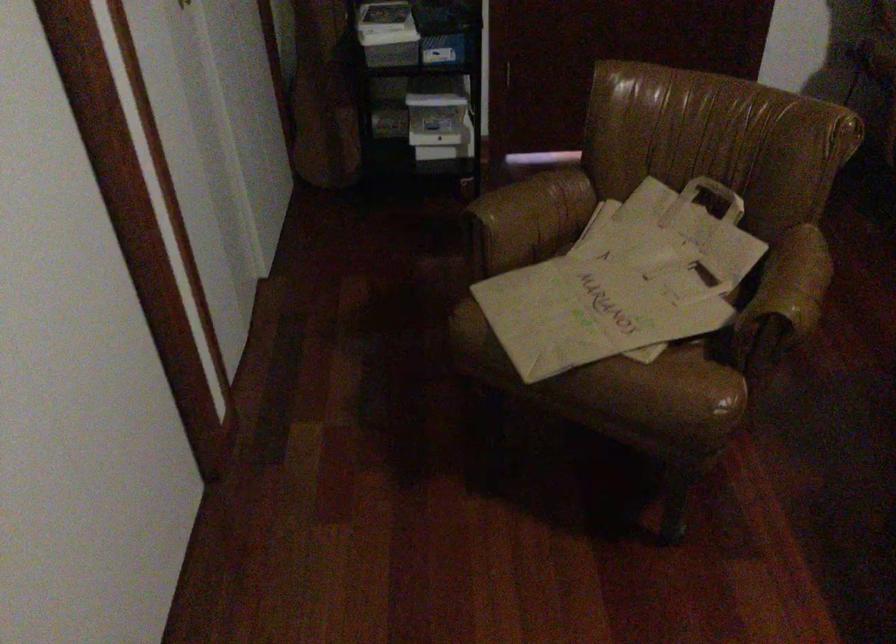
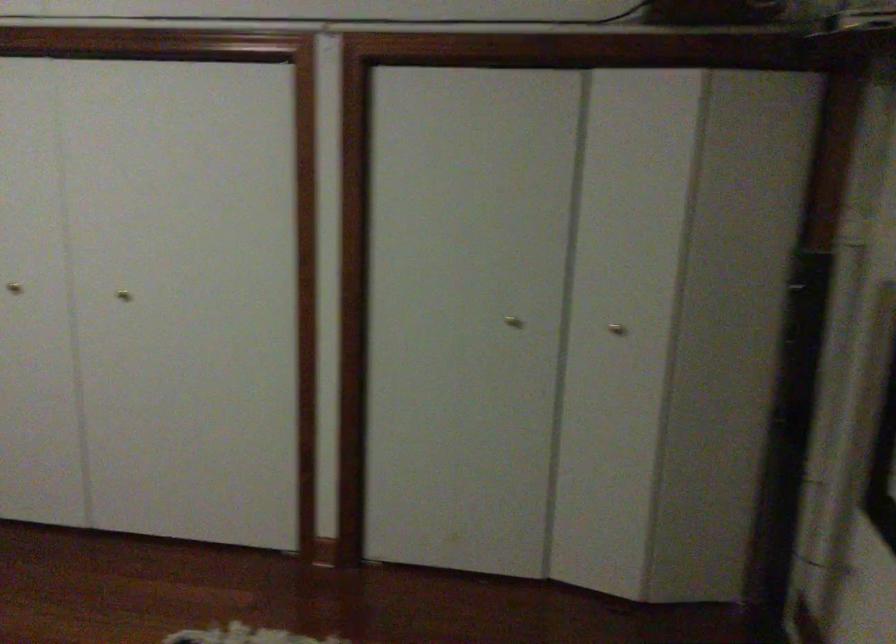
Question: How did the camera likely rotate?

Choices:
 (A) Left
 (B) Right
 (C) Up
 (D) Down

Answer: (B)